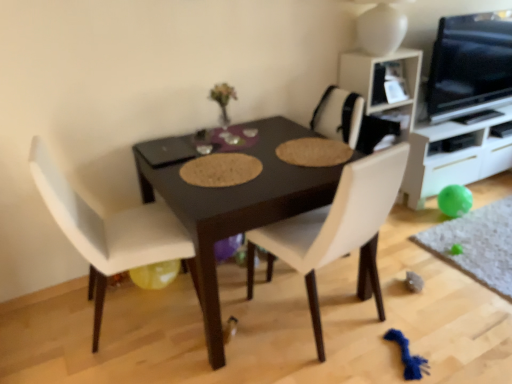
Identify the location of spots to the right of dark wood table at center. (431, 291).